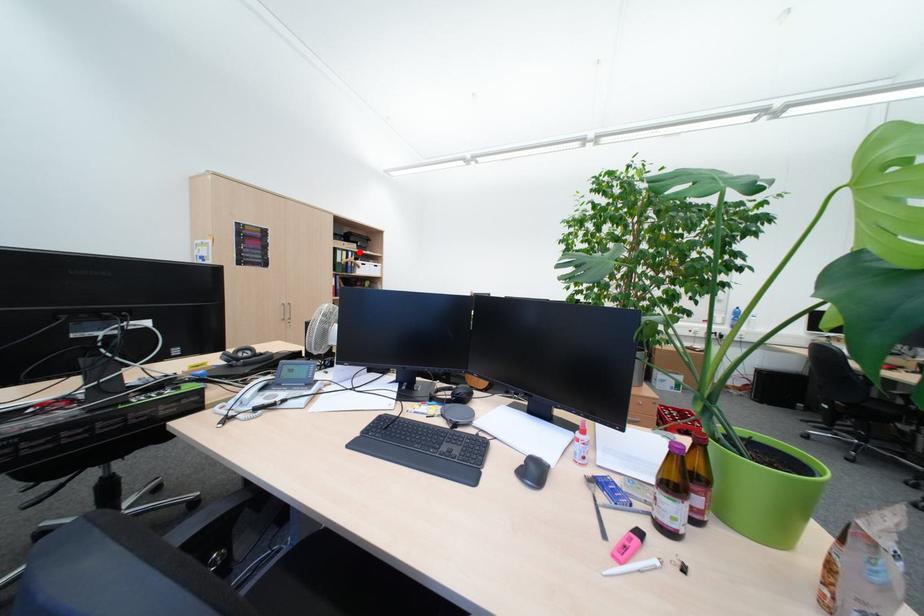
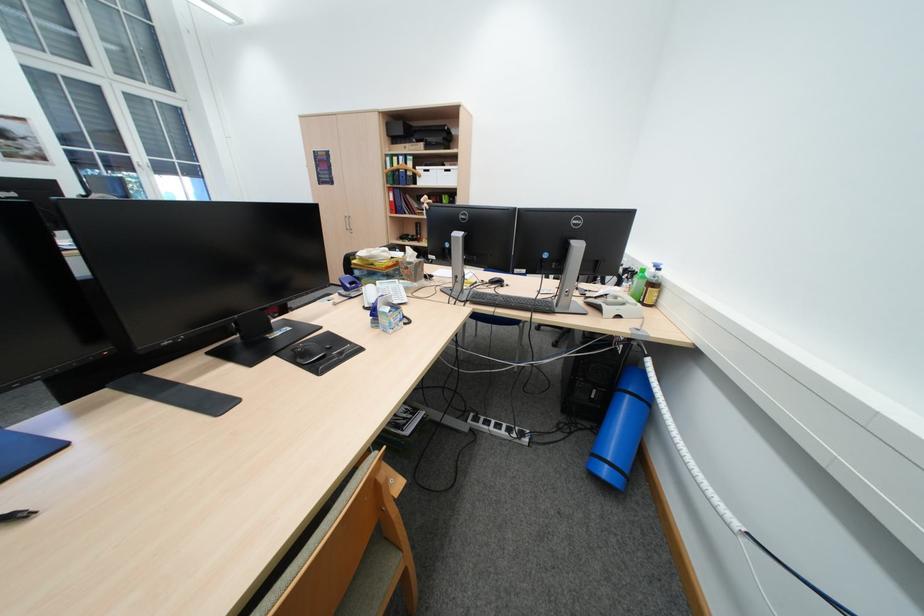
The point at the highlighted location is marked in the first image. Where is the corresponding point in the second image?

(409, 156)